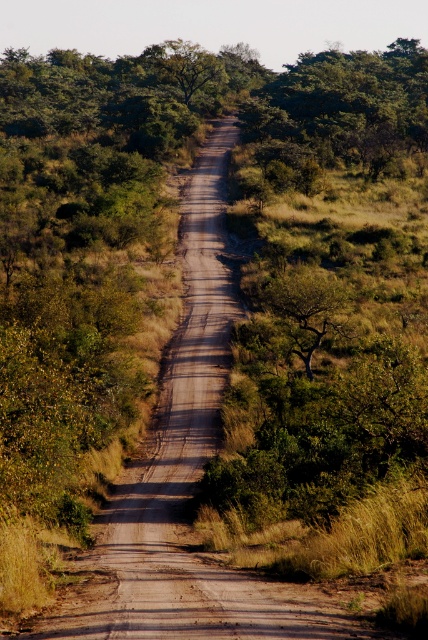
Does green leafy tree at upper center appear over green leafy tree at center?

Indeed, green leafy tree at upper center is positioned over green leafy tree at center.

Describe the element at coordinates (341, 113) in the screenshot. I see `green leafy tree at upper center` at that location.

What do you see at coordinates (341, 113) in the screenshot? This screenshot has width=428, height=640. I see `green leafy tree at upper center` at bounding box center [341, 113].

Identify the location of green leafy tree at upper center. (341, 113).